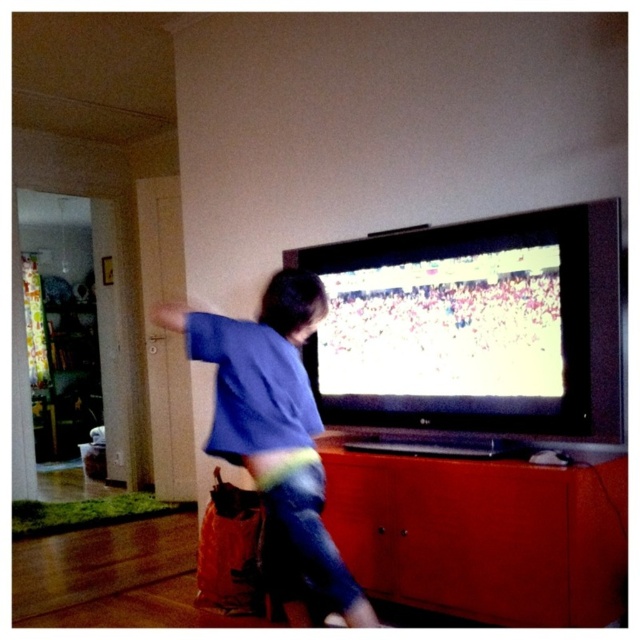
Does matte wood dresser at lower center have a lesser height compared to blue cotton shirt at center?

Indeed, matte wood dresser at lower center has a lesser height compared to blue cotton shirt at center.

Who is lower down, matte wood dresser at lower center or blue cotton shirt at center?

Positioned lower is matte wood dresser at lower center.

Between point (547, 529) and point (182, 308), which one is positioned in front?

Point (547, 529) is more forward.

Where is `matte wood dresser at lower center`? matte wood dresser at lower center is located at coordinates (483, 532).